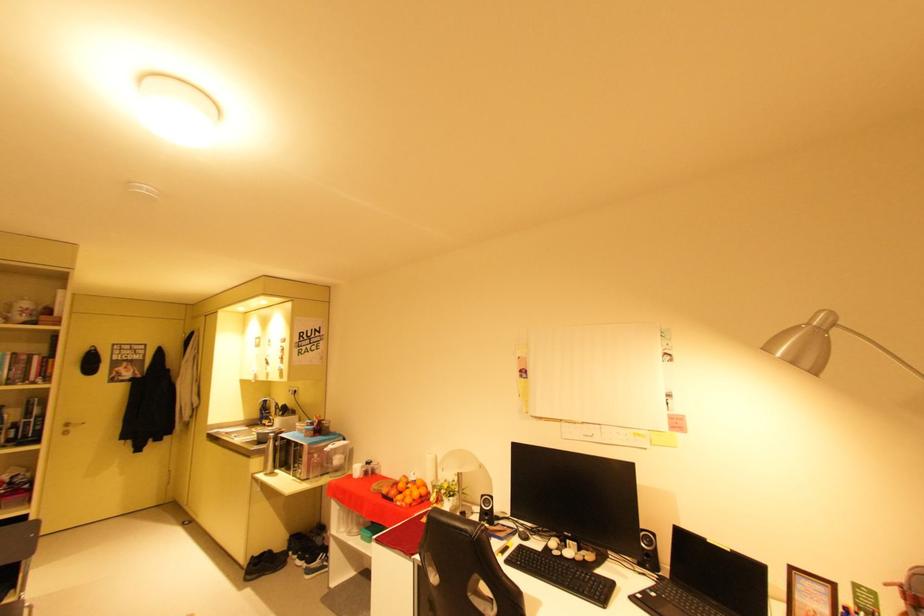
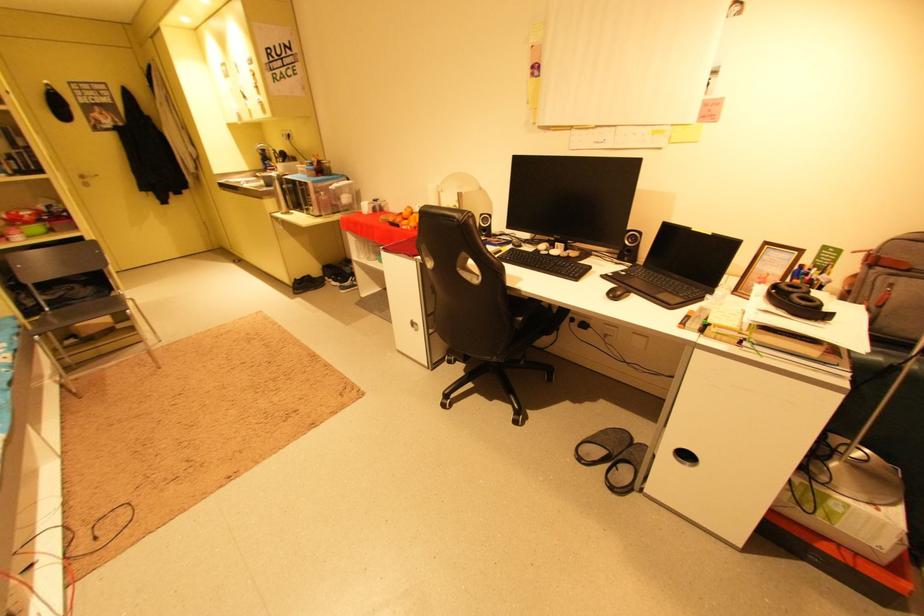
Question: Based on the continuous images, in which direction is the camera rotating? Reply with the corresponding letter.

Choices:
 (A) Left
 (B) Right
 (C) Up
 (D) Down

Answer: (D)